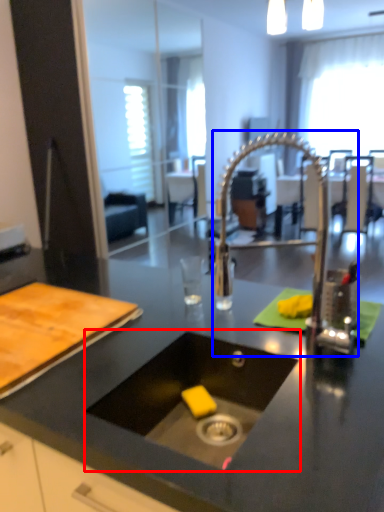
Question: Which of the following is the farthest to the observer, sink (highlighted by a red box) or faucet (highlighted by a blue box)?

Choices:
 (A) sink
 (B) faucet

Answer: (B)